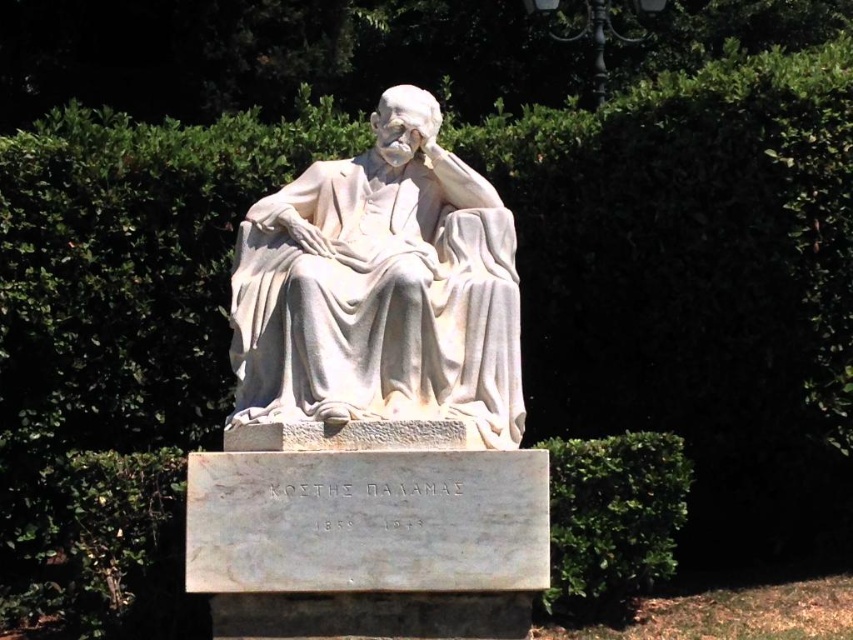
Question: Can you confirm if white marble statue at center is positioned to the left of green leafy hedge at lower right?

Choices:
 (A) yes
 (B) no

Answer: (A)

Question: Observing the image, what is the correct spatial positioning of white marble statue at center in reference to green leafy hedge at lower right?

Choices:
 (A) right
 (B) left

Answer: (B)

Question: Which point is farther from the camera taking this photo?

Choices:
 (A) (378, 216)
 (B) (637, 598)

Answer: (B)

Question: Which object is farther from the camera taking this photo?

Choices:
 (A) white marble statue at center
 (B) green leafy hedge at lower right

Answer: (B)

Question: Is white marble statue at center thinner than green leafy hedge at lower right?

Choices:
 (A) yes
 (B) no

Answer: (A)